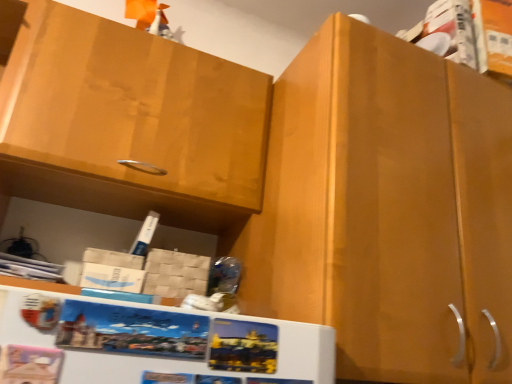
At what (x,y) coordinates should I click in order to perform the action: click on matte wood cabinet at center, which ranks as the 1th cabinetry in right-to-left order. Please return your answer as a coordinate pair (x, y). This screenshot has width=512, height=384. Looking at the image, I should click on (393, 207).

Measure the distance between matte wood cabinet at center, which ranks as the 1th cabinetry in right-to-left order, and camera.

A distance of 25.84 inches exists between matte wood cabinet at center, which ranks as the 1th cabinetry in right-to-left order, and camera.

What do you see at coordinates (393, 207) in the screenshot?
I see `matte wood cabinet at center, which ranks as the 1th cabinetry in right-to-left order` at bounding box center [393, 207].

Locate an element on the screen. Image resolution: width=512 pixels, height=384 pixels. matte wood cabinet at upper left, marked as the 1th cabinetry in a left-to-right arrangement is located at coordinates (133, 107).

The height and width of the screenshot is (384, 512). What do you see at coordinates (133, 107) in the screenshot? I see `matte wood cabinet at upper left, marked as the second cabinetry in a right-to-left arrangement` at bounding box center [133, 107].

The width and height of the screenshot is (512, 384). In order to click on matte wood cabinet at center, which appears as the 2th cabinetry when viewed from the left in this screenshot , I will do `click(393, 207)`.

Does matte wood cabinet at center, which appears as the 2th cabinetry when viewed from the left, appear on the right side of matte wood cabinet at upper left, marked as the 1th cabinetry in a left-to-right arrangement?

Correct, you'll find matte wood cabinet at center, which appears as the 2th cabinetry when viewed from the left, to the right of matte wood cabinet at upper left, marked as the 1th cabinetry in a left-to-right arrangement.

Which is behind, matte wood cabinet at center, which appears as the 2th cabinetry when viewed from the left, or matte wood cabinet at upper left, marked as the second cabinetry in a right-to-left arrangement?

matte wood cabinet at upper left, marked as the second cabinetry in a right-to-left arrangement.

Based on the photo, which point is more forward, (417,171) or (176,45)?

The point (417,171) is more forward.

From the image's perspective, which one is positioned lower, matte wood cabinet at center, which ranks as the 1th cabinetry in right-to-left order, or matte wood cabinet at upper left, marked as the second cabinetry in a right-to-left arrangement?

From the image's view, matte wood cabinet at center, which ranks as the 1th cabinetry in right-to-left order, is below.

From a real-world perspective, is matte wood cabinet at center, which appears as the 2th cabinetry when viewed from the left, over matte wood cabinet at upper left, marked as the 1th cabinetry in a left-to-right arrangement?

No, from a real-world perspective, matte wood cabinet at center, which appears as the 2th cabinetry when viewed from the left, is not on top of matte wood cabinet at upper left, marked as the 1th cabinetry in a left-to-right arrangement.

Which of these two, matte wood cabinet at center, which ranks as the 1th cabinetry in right-to-left order, or matte wood cabinet at upper left, marked as the second cabinetry in a right-to-left arrangement, is wider?

matte wood cabinet at center, which ranks as the 1th cabinetry in right-to-left order.

Can you confirm if matte wood cabinet at center, which appears as the 2th cabinetry when viewed from the left, is taller than matte wood cabinet at upper left, marked as the 1th cabinetry in a left-to-right arrangement?

Correct, matte wood cabinet at center, which appears as the 2th cabinetry when viewed from the left, is much taller as matte wood cabinet at upper left, marked as the 1th cabinetry in a left-to-right arrangement.

Is matte wood cabinet at center, which ranks as the 1th cabinetry in right-to-left order, bigger or smaller than matte wood cabinet at upper left, marked as the second cabinetry in a right-to-left arrangement?

Clearly, matte wood cabinet at center, which ranks as the 1th cabinetry in right-to-left order, is larger in size than matte wood cabinet at upper left, marked as the second cabinetry in a right-to-left arrangement.

Is matte wood cabinet at center, which ranks as the 1th cabinetry in right-to-left order, positioned beyond the bounds of matte wood cabinet at upper left, marked as the second cabinetry in a right-to-left arrangement?

matte wood cabinet at center, which ranks as the 1th cabinetry in right-to-left order, is positioned outside matte wood cabinet at upper left, marked as the second cabinetry in a right-to-left arrangement.

Looking at this image, would you consider matte wood cabinet at center, which ranks as the 1th cabinetry in right-to-left order, to be distant from matte wood cabinet at upper left, marked as the second cabinetry in a right-to-left arrangement?

That's not correct — matte wood cabinet at center, which ranks as the 1th cabinetry in right-to-left order, is a little close to matte wood cabinet at upper left, marked as the second cabinetry in a right-to-left arrangement.

Could you tell me if matte wood cabinet at center, which ranks as the 1th cabinetry in right-to-left order, is turned towards matte wood cabinet at upper left, marked as the 1th cabinetry in a left-to-right arrangement?

No, matte wood cabinet at center, which ranks as the 1th cabinetry in right-to-left order, is not facing towards matte wood cabinet at upper left, marked as the 1th cabinetry in a left-to-right arrangement.

Find the location of a particular element. cabinetry that is above the matte wood cabinet at center, which appears as the 2th cabinetry when viewed from the left (from a real-world perspective) is located at coordinates (133, 107).

Does matte wood cabinet at upper left, marked as the 1th cabinetry in a left-to-right arrangement, appear on the right side of matte wood cabinet at center, which ranks as the 1th cabinetry in right-to-left order?

No.

Which object is closer to the camera taking this photo, matte wood cabinet at upper left, marked as the second cabinetry in a right-to-left arrangement, or matte wood cabinet at center, which ranks as the 1th cabinetry in right-to-left order?

matte wood cabinet at center, which ranks as the 1th cabinetry in right-to-left order, is more forward.

Considering the positions of point (57, 4) and point (410, 105), is point (57, 4) closer or farther from the camera than point (410, 105)?

Point (57, 4) is farther from the camera than point (410, 105).

From the image's perspective, would you say matte wood cabinet at upper left, marked as the second cabinetry in a right-to-left arrangement, is positioned over matte wood cabinet at center, which ranks as the 1th cabinetry in right-to-left order?

Yes, from the image's perspective, matte wood cabinet at upper left, marked as the second cabinetry in a right-to-left arrangement, is over matte wood cabinet at center, which ranks as the 1th cabinetry in right-to-left order.

From a real-world perspective, between matte wood cabinet at upper left, marked as the second cabinetry in a right-to-left arrangement, and matte wood cabinet at center, which appears as the 2th cabinetry when viewed from the left, who is vertically lower?

matte wood cabinet at center, which appears as the 2th cabinetry when viewed from the left, is physically lower.

Can you confirm if matte wood cabinet at upper left, marked as the second cabinetry in a right-to-left arrangement, is wider than matte wood cabinet at center, which appears as the 2th cabinetry when viewed from the left?

In fact, matte wood cabinet at upper left, marked as the second cabinetry in a right-to-left arrangement, might be narrower than matte wood cabinet at center, which appears as the 2th cabinetry when viewed from the left.

Who is taller, matte wood cabinet at upper left, marked as the second cabinetry in a right-to-left arrangement, or matte wood cabinet at center, which appears as the 2th cabinetry when viewed from the left?

Standing taller between the two is matte wood cabinet at center, which appears as the 2th cabinetry when viewed from the left.

From the picture: Considering the relative sizes of matte wood cabinet at upper left, marked as the 1th cabinetry in a left-to-right arrangement, and matte wood cabinet at center, which ranks as the 1th cabinetry in right-to-left order, in the image provided, is matte wood cabinet at upper left, marked as the 1th cabinetry in a left-to-right arrangement, smaller than matte wood cabinet at center, which ranks as the 1th cabinetry in right-to-left order,?

Yes, matte wood cabinet at upper left, marked as the 1th cabinetry in a left-to-right arrangement, is smaller than matte wood cabinet at center, which ranks as the 1th cabinetry in right-to-left order.

Is matte wood cabinet at upper left, marked as the 1th cabinetry in a left-to-right arrangement, inside or outside of matte wood cabinet at center, which appears as the 2th cabinetry when viewed from the left?

matte wood cabinet at upper left, marked as the 1th cabinetry in a left-to-right arrangement, is spatially situated outside matte wood cabinet at center, which appears as the 2th cabinetry when viewed from the left.

Would you say matte wood cabinet at upper left, marked as the second cabinetry in a right-to-left arrangement, is a long distance from matte wood cabinet at center, which appears as the 2th cabinetry when viewed from the left?

No, matte wood cabinet at upper left, marked as the second cabinetry in a right-to-left arrangement, is in close proximity to matte wood cabinet at center, which appears as the 2th cabinetry when viewed from the left.

Is matte wood cabinet at upper left, marked as the second cabinetry in a right-to-left arrangement, looking in the opposite direction of matte wood cabinet at center, which ranks as the 1th cabinetry in right-to-left order?

No, matte wood cabinet at upper left, marked as the second cabinetry in a right-to-left arrangement, is not facing the opposite direction of matte wood cabinet at center, which ranks as the 1th cabinetry in right-to-left order.

Image resolution: width=512 pixels, height=384 pixels. Find the location of `cabinetry that is on the left side of matte wood cabinet at center, which ranks as the 1th cabinetry in right-to-left order`. cabinetry that is on the left side of matte wood cabinet at center, which ranks as the 1th cabinetry in right-to-left order is located at coordinates (133, 107).

You are a GUI agent. You are given a task and a screenshot of the screen. Output one action in this format:
    pyautogui.click(x=<x>, y=<y>)
    Task: Click on the cabinetry located behind the matte wood cabinet at center, which ranks as the 1th cabinetry in right-to-left order
    The image size is (512, 384).
    Given the screenshot: What is the action you would take?
    pyautogui.click(x=133, y=107)

At what (x,y) coordinates should I click in order to perform the action: click on cabinetry below the matte wood cabinet at upper left, marked as the 1th cabinetry in a left-to-right arrangement (from a real-world perspective). Please return your answer as a coordinate pair (x, y). Looking at the image, I should click on (393, 207).